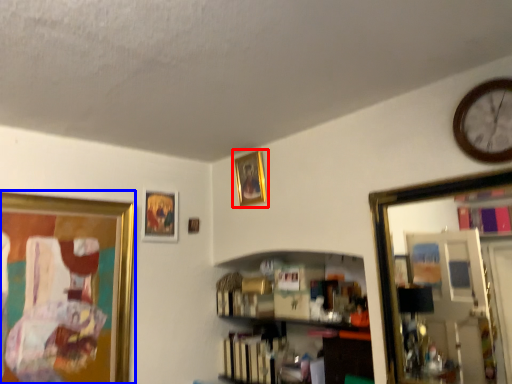
Question: Which object appears closest to the camera in this image, picture frame (highlighted by a red box) or picture frame (highlighted by a blue box)?

Choices:
 (A) picture frame
 (B) picture frame

Answer: (B)